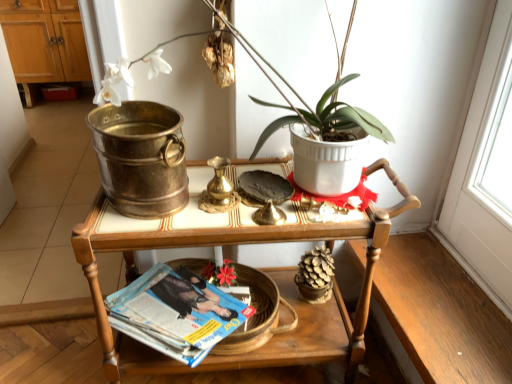
Question: Considering the positions of brushed metal bucket at upper left and white ceramic pot at upper center in the image, is brushed metal bucket at upper left bigger or smaller than white ceramic pot at upper center?

Choices:
 (A) small
 (B) big

Answer: (B)

Question: Which is correct: brushed metal bucket at upper left is inside white ceramic pot at upper center, or outside of it?

Choices:
 (A) outside
 (B) inside

Answer: (A)

Question: Which is nearer to the wooden tray at center?

Choices:
 (A) brushed metal bucket at upper left
 (B) white ceramic pot at upper center
 (C) blue glossy magazine at lower center

Answer: (C)

Question: Which is farther from the white ceramic pot at upper center?

Choices:
 (A) wooden tray at center
 (B) blue glossy magazine at lower center
 (C) brushed metal bucket at upper left

Answer: (C)